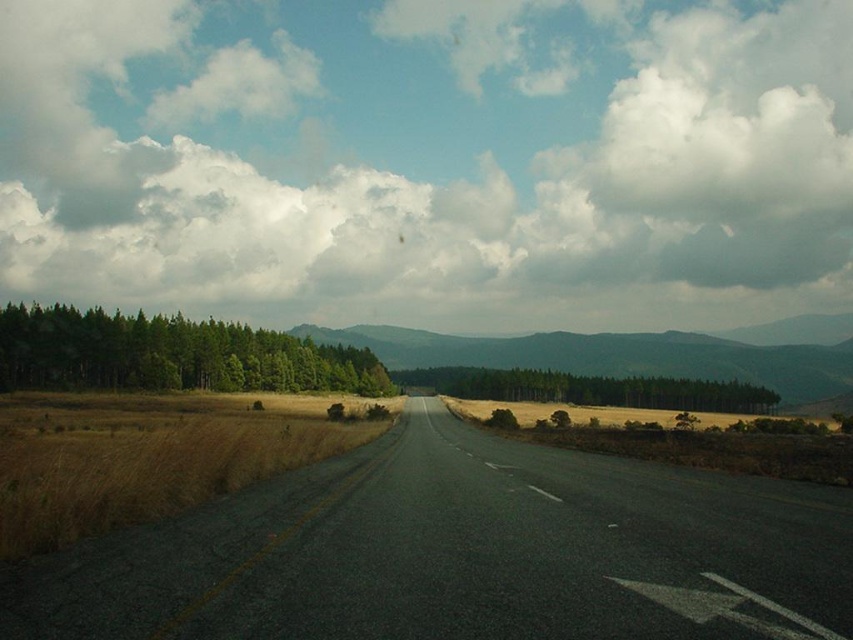
Question: Which object is the farthest from the asphalt road at center?

Choices:
 (A) cloudy sky at upper center
 (B) green forested mountain at center
 (C) green matte trees at center

Answer: (A)

Question: Is asphalt road at center bigger than green matte forest at left?

Choices:
 (A) no
 (B) yes

Answer: (A)

Question: Is asphalt road at center thinner than green forested mountain at center?

Choices:
 (A) yes
 (B) no

Answer: (A)

Question: Is asphalt road at center further to camera compared to green matte forest at left?

Choices:
 (A) no
 (B) yes

Answer: (A)

Question: Which object is closer to the camera taking this photo?

Choices:
 (A) asphalt road at center
 (B) green forested mountain at center
 (C) green matte trees at center
 (D) green matte forest at left

Answer: (A)

Question: Which of the following is the closest to the observer?

Choices:
 (A) green matte forest at left
 (B) green matte trees at center

Answer: (A)